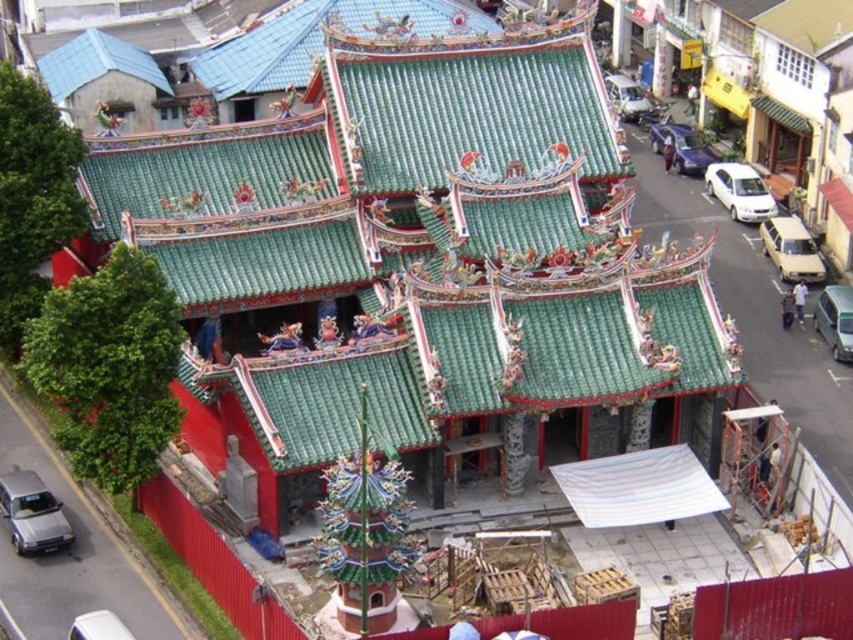
Is white matte sedan at center wider than white matte car at right?

Correct, the width of white matte sedan at center exceeds that of white matte car at right.

Between white matte sedan at center and white matte car at right, which one has more height?

white matte sedan at center

Find the location of a particular element. The image size is (853, 640). white matte sedan at center is located at coordinates (752, 220).

Does point (802, 224) lie in front of point (76, 634)?

No.

Image resolution: width=853 pixels, height=640 pixels. What do you see at coordinates (791, 250) in the screenshot? I see `yellow matte car at right` at bounding box center [791, 250].

Does point (791, 236) come closer to viewer compared to point (73, 634)?

That is False.

Locate an element on the screen. The width and height of the screenshot is (853, 640). yellow matte car at right is located at coordinates (791, 250).

Is point (784, 264) farther from viewer compared to point (85, 612)?

Yes, it is behind point (85, 612).

Is white matte sedan at center positioned at the back of white plastic car at lower left?

Yes, it is.

This screenshot has width=853, height=640. What are the coordinates of `white matte sedan at center` in the screenshot? It's located at (752, 220).

Find the location of a particular element. The width and height of the screenshot is (853, 640). white matte sedan at center is located at coordinates (752, 220).